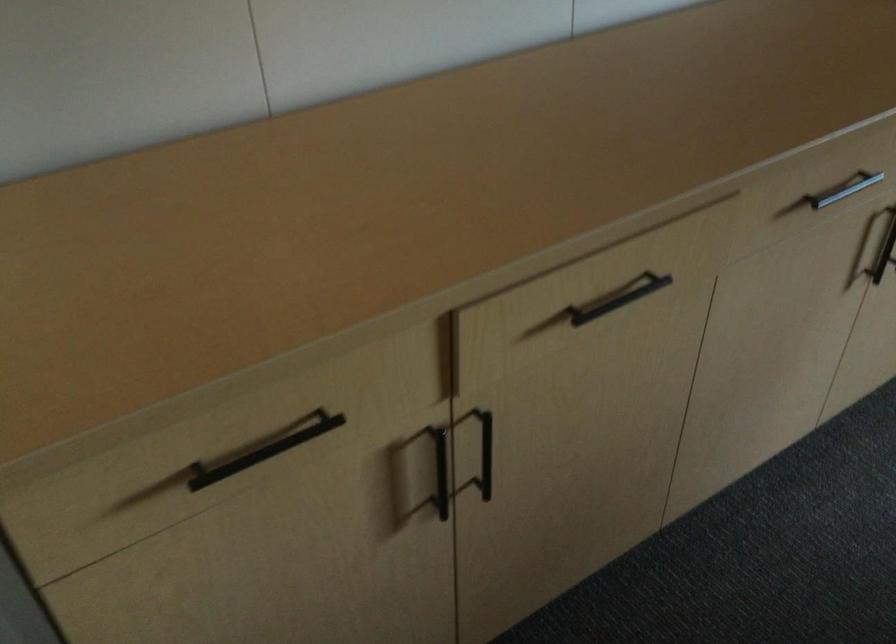
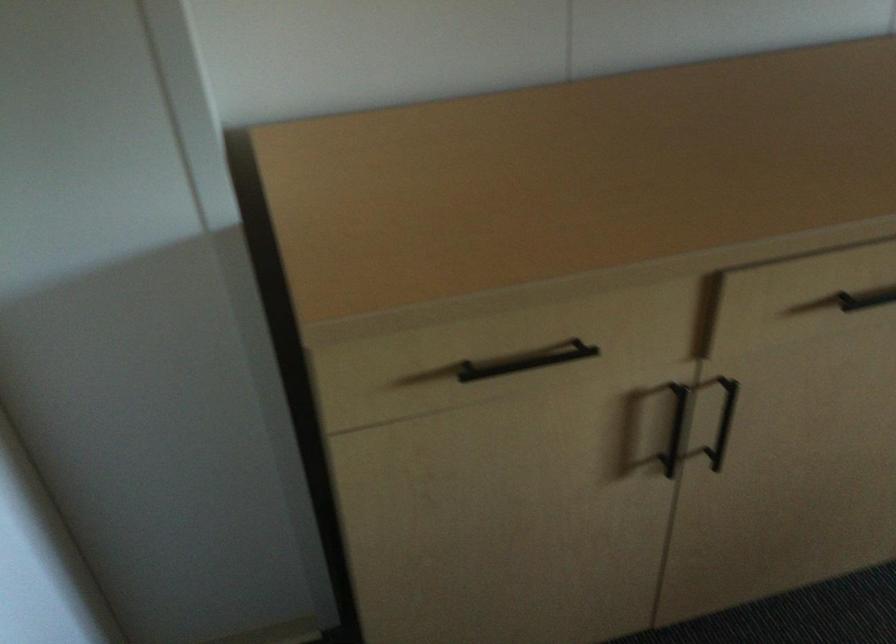
Where in the second image is the point corresponding to the point at 263,444 from the first image?

(526, 361)